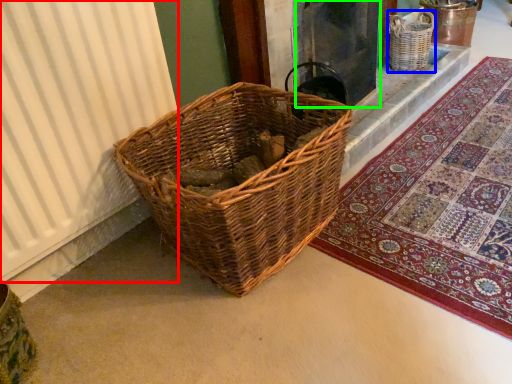
Question: Which is farther away from curtain (highlighted by a red box)? basket (highlighted by a blue box) or screen door (highlighted by a green box)?

Choices:
 (A) basket
 (B) screen door

Answer: (A)